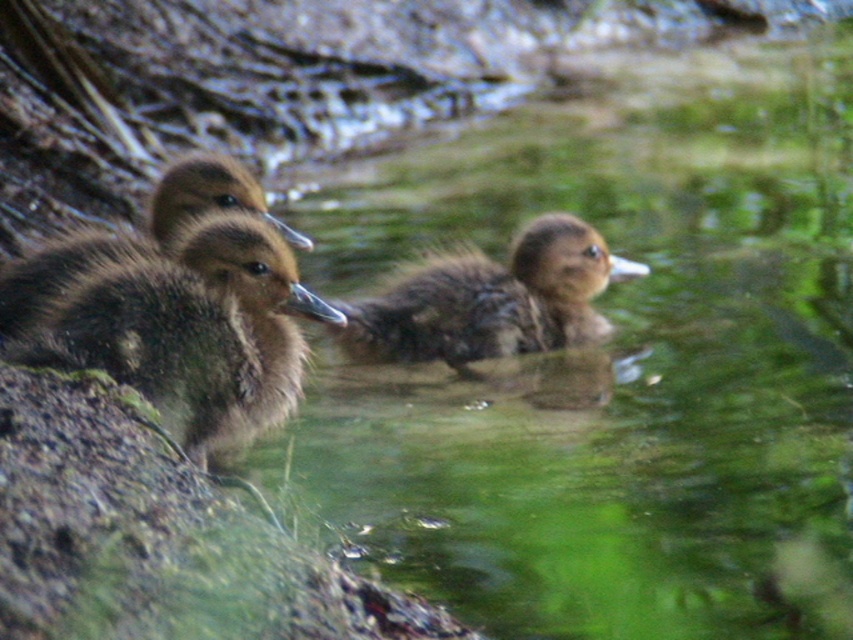
Does brown fuzzy duckling at left have a greater width compared to brown fuzzy duckling at center?

No.

Between brown fuzzy duckling at left and brown fuzzy duckling at center, which one is positioned lower?

brown fuzzy duckling at left

What do you see at coordinates (173, 323) in the screenshot? I see `brown fuzzy duckling at left` at bounding box center [173, 323].

Find the location of a particular element. The image size is (853, 640). brown fuzzy duckling at left is located at coordinates (173, 323).